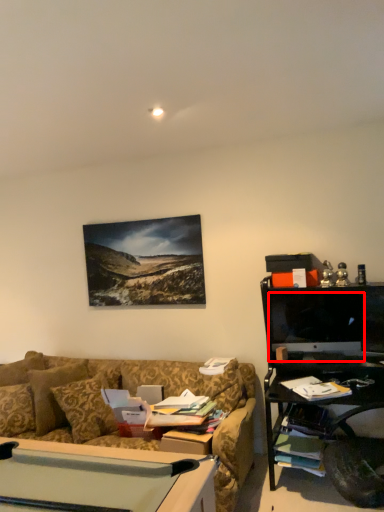
Question: From the image's perspective, where is computer monitor (annotated by the red box) located in relation to pillow in the image?

Choices:
 (A) below
 (B) above

Answer: (B)